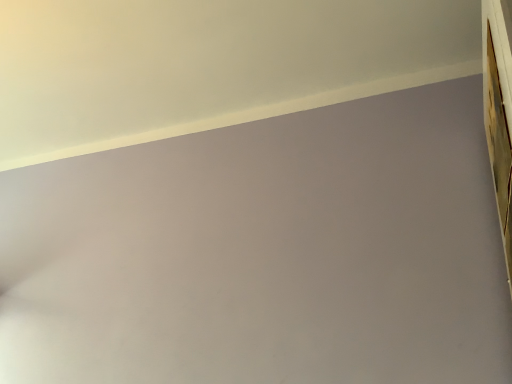
Image resolution: width=512 pixels, height=384 pixels. Describe the element at coordinates (258, 112) in the screenshot. I see `white smooth wall at upper left` at that location.

This screenshot has height=384, width=512. In order to click on white smooth wall at upper left in this screenshot , I will do `click(258, 112)`.

This screenshot has height=384, width=512. What do you see at coordinates (498, 118) in the screenshot?
I see `wooden frame at upper right` at bounding box center [498, 118].

Find the location of a particular element. The height and width of the screenshot is (384, 512). wooden frame at upper right is located at coordinates (498, 118).

What is the approximate width of wooden frame at upper right?

It is 0.39 inches.

In order to face wooden frame at upper right, should I rotate leftwards or rightwards?

Rotate your view right by about 29.578°.

The height and width of the screenshot is (384, 512). Find the location of `white smooth wall at upper left`. white smooth wall at upper left is located at coordinates (258, 112).

Consider the image. In the image, is wooden frame at upper right on the left side or the right side of white smooth wall at upper left?

From the image, it's evident that wooden frame at upper right is to the right of white smooth wall at upper left.

Considering the relative positions of wooden frame at upper right and white smooth wall at upper left in the image provided, is wooden frame at upper right in front of white smooth wall at upper left?

That is False.

Does point (499, 150) come behind point (360, 95)?

That is False.

From the image's perspective, is wooden frame at upper right positioned above or below white smooth wall at upper left?

Clearly, from the image's perspective, wooden frame at upper right is below white smooth wall at upper left.

In the scene shown: From a real-world perspective, who is located lower, wooden frame at upper right or white smooth wall at upper left?

From a 3D spatial view, wooden frame at upper right is below.

Considering the relative sizes of wooden frame at upper right and white smooth wall at upper left in the image provided, is wooden frame at upper right wider than white smooth wall at upper left?

No.

Between wooden frame at upper right and white smooth wall at upper left, which one has less height?

white smooth wall at upper left is shorter.

Which of these two, wooden frame at upper right or white smooth wall at upper left, is smaller?

With smaller size is wooden frame at upper right.

From the picture: Is wooden frame at upper right not within white smooth wall at upper left?

Yes, wooden frame at upper right is outside of white smooth wall at upper left.

Can you see wooden frame at upper right touching white smooth wall at upper left?

wooden frame at upper right is not next to white smooth wall at upper left, and they're not touching.

Is wooden frame at upper right facing towards white smooth wall at upper left?

Yes, wooden frame at upper right is turned towards white smooth wall at upper left.

Can you tell me how much wooden frame at upper right and white smooth wall at upper left differ in facing direction?

They differ by 179 degrees in their facing directions.

Find the location of `window sill in front of the wooden frame at upper right`. window sill in front of the wooden frame at upper right is located at coordinates (x=258, y=112).

Can you confirm if white smooth wall at upper left is positioned to the right of wooden frame at upper right?

Incorrect, white smooth wall at upper left is not on the right side of wooden frame at upper right.

Which is behind, white smooth wall at upper left or wooden frame at upper right?

Positioned behind is wooden frame at upper right.

Which is in front, point (331, 103) or point (501, 44)?

The point (501, 44) is more forward.

Consider the image. From the image's perspective, between white smooth wall at upper left and wooden frame at upper right, which one is located above?

white smooth wall at upper left appears higher in the image.

From a real-world perspective, between white smooth wall at upper left and wooden frame at upper right, who is vertically lower?

From a 3D spatial view, wooden frame at upper right is below.

Between white smooth wall at upper left and wooden frame at upper right, which one has larger width?

With larger width is white smooth wall at upper left.

Does white smooth wall at upper left have a greater height compared to wooden frame at upper right?

No.

From the picture: Can you confirm if white smooth wall at upper left is smaller than wooden frame at upper right?

No, white smooth wall at upper left is not smaller than wooden frame at upper right.

Is white smooth wall at upper left not within wooden frame at upper right?

white smooth wall at upper left is positioned outside wooden frame at upper right.

Is white smooth wall at upper left placed right next to wooden frame at upper right?

They are not placed beside each other.

In the scene shown: Is wooden frame at upper right at the back of white smooth wall at upper left?

white smooth wall at upper left is not turned away from wooden frame at upper right.

What's the angular difference between white smooth wall at upper left and wooden frame at upper right's facing directions?

They differ by 179 degrees in their facing directions.

Identify the location of window sill that appears above the wooden frame at upper right (from a real-world perspective). The image size is (512, 384). (258, 112).

I want to click on window sill located in front of the wooden frame at upper right, so click(x=258, y=112).

Find the location of a particular element. The image size is (512, 384). window sill that appears above the wooden frame at upper right (from the image's perspective) is located at coordinates coord(258,112).